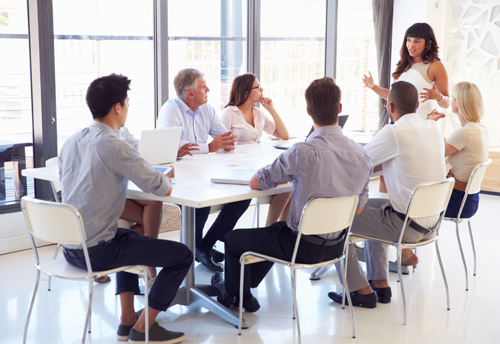
The image size is (500, 344). I want to click on chairs, so click(x=54, y=221), click(x=329, y=222), click(x=429, y=206), click(x=480, y=180).